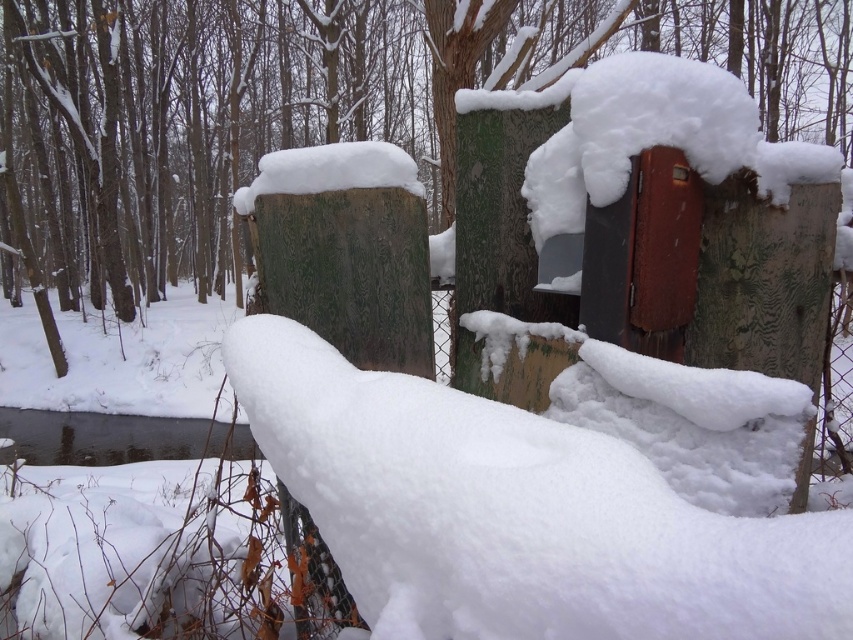
You are standing in the winter forest scene and want to take a photo of the white fluffy snow at center and the clear ice water at lower left. Which object will appear larger in your photo?

The white fluffy snow at center will appear larger in the photo because it is closer to the viewer than the clear ice water at lower left.

You are a hiker who wants to cross from the white fluffy snow at center to the clear ice water at lower left. Can you step on the snow without slipping into the water?

The white fluffy snow at center is above clear ice water at lower left, so the snow is on higher ground. However, the snow might be slippery near the edge, so there is a risk of slipping into the water. Proceed with caution.